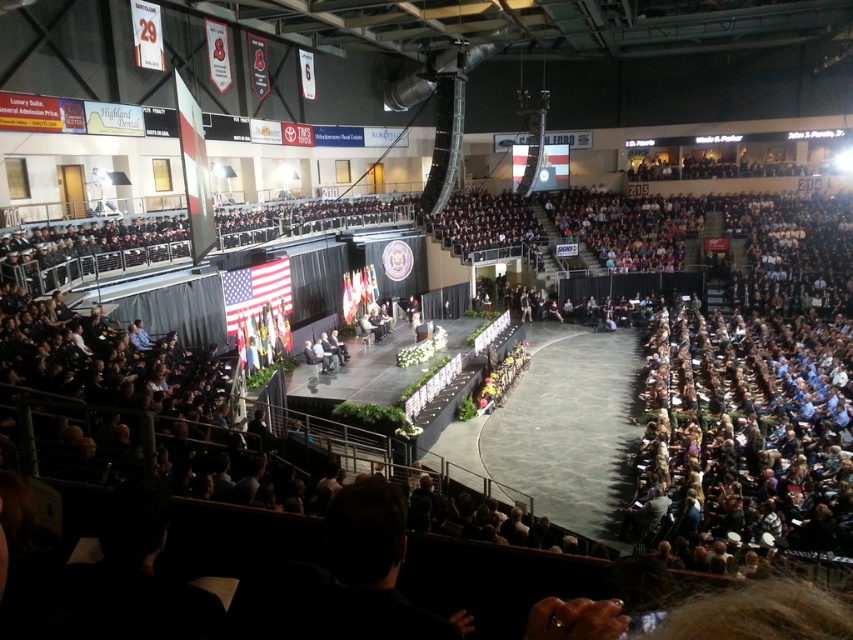
Question: Which point is farther from the camera taking this photo?

Choices:
 (A) pos(347,321)
 (B) pos(221,282)

Answer: (A)

Question: Which object is closer to the camera taking this photo?

Choices:
 (A) matte american flag at center
 (B) silk american flag at center stage

Answer: (A)

Question: Does matte american flag at center have a greater width compared to silk american flag at center stage?

Choices:
 (A) no
 (B) yes

Answer: (B)

Question: Among these points, which one is farthest from the camera?

Choices:
 (A) (355, 282)
 (B) (271, 291)

Answer: (A)

Question: Does matte american flag at center have a lesser width compared to silk american flag at center stage?

Choices:
 (A) yes
 (B) no

Answer: (B)

Question: Considering the relative positions of matte american flag at center and silk american flag at center stage in the image provided, where is matte american flag at center located with respect to silk american flag at center stage?

Choices:
 (A) above
 (B) below

Answer: (B)